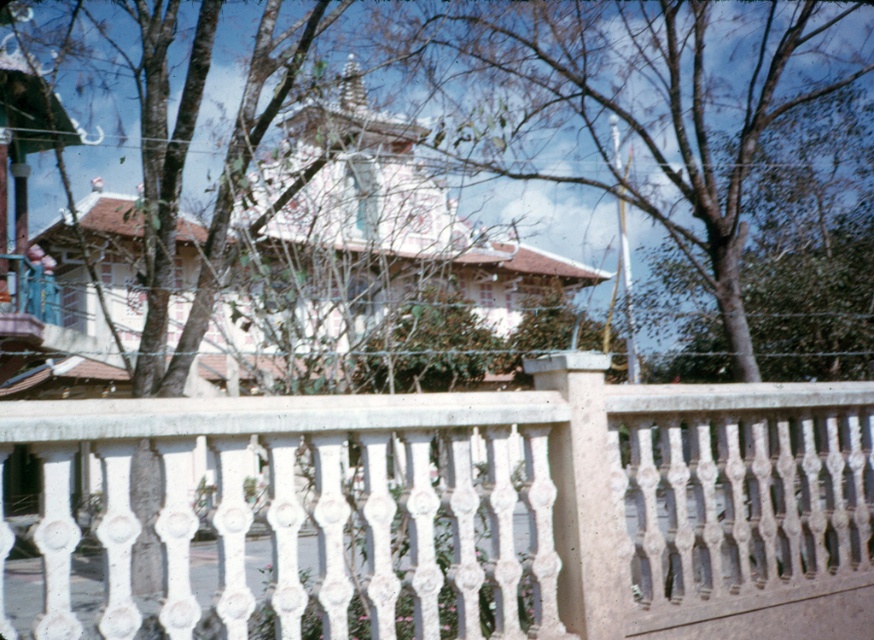
Does white stone fence at center have a smaller size compared to brown leafy tree at center?

No, white stone fence at center is not smaller than brown leafy tree at center.

Consider the image. Who is more distant from viewer, (162, 499) or (841, 24)?

The point (841, 24) is more distant.

At what (x,y) coordinates should I click in order to perform the action: click on white stone fence at center. Please return your answer as a coordinate pair (x, y). Looking at the image, I should click on (466, 509).